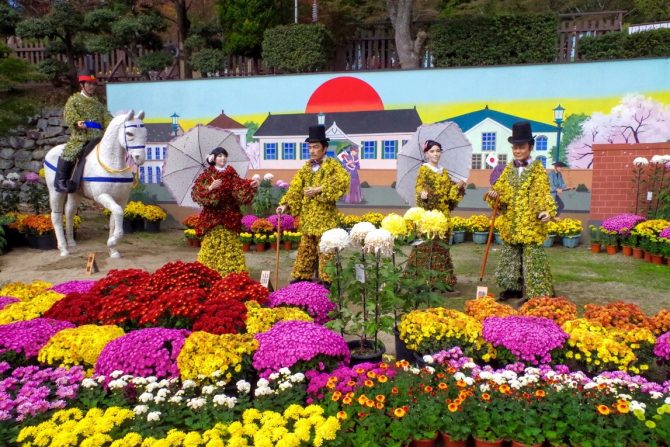
The width and height of the screenshot is (670, 447). Identify the location of square blue windows. (268, 151), (283, 150), (304, 151), (368, 150), (383, 153), (492, 140).